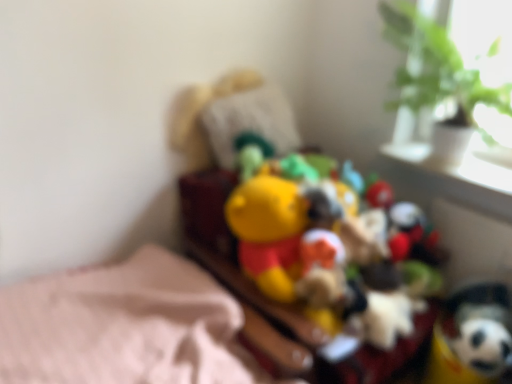
This screenshot has height=384, width=512. Describe the element at coordinates (449, 178) in the screenshot. I see `white glossy window sill at upper right` at that location.

What do you see at coordinates (437, 73) in the screenshot? The height and width of the screenshot is (384, 512). I see `green leafy plant at upper right` at bounding box center [437, 73].

Locate an element on the screen. This screenshot has height=384, width=512. yellow plush toy at center, which ranks as the 1th toy in left-to-right order is located at coordinates (317, 245).

Is soft plush toy at lower right, the second toy when ordered from left to right, at the left side of white glossy window sill at upper right?

Yes, soft plush toy at lower right, the second toy when ordered from left to right, is to the left of white glossy window sill at upper right.

Based on their sizes in the image, would you say soft plush toy at lower right, placed as the first toy when sorted from right to left, is bigger or smaller than white glossy window sill at upper right?

Considering their sizes, soft plush toy at lower right, placed as the first toy when sorted from right to left, takes up more space than white glossy window sill at upper right.

From the image's perspective, is soft plush toy at lower right, the second toy when ordered from left to right, on top of white glossy window sill at upper right?

No.

From a real-world perspective, which is physically above, soft plush toy at lower right, placed as the first toy when sorted from right to left, or white glossy window sill at upper right?

white glossy window sill at upper right is physically above.

Consider the image. From the image's perspective, is green leafy plant at upper right positioned above or below soft plush toy at lower right, the second toy when ordered from left to right?

From the image's perspective, green leafy plant at upper right appears above soft plush toy at lower right, the second toy when ordered from left to right.

Is the depth of green leafy plant at upper right less than that of soft plush toy at lower right, the second toy when ordered from left to right?

Yes, it is in front of soft plush toy at lower right, the second toy when ordered from left to right.

Is green leafy plant at upper right at the right side of soft plush toy at lower right, placed as the first toy when sorted from right to left?

Incorrect, green leafy plant at upper right is not on the right side of soft plush toy at lower right, placed as the first toy when sorted from right to left.

Could you tell me if green leafy plant at upper right is turned towards soft plush toy at lower right, the second toy when ordered from left to right?

No, green leafy plant at upper right is not oriented towards soft plush toy at lower right, the second toy when ordered from left to right.

Is soft plush toy at lower right, the second toy when ordered from left to right, with green leafy plant at upper right?

No, soft plush toy at lower right, the second toy when ordered from left to right, is not next to green leafy plant at upper right.

How different are the orientations of soft plush toy at lower right, the second toy when ordered from left to right, and green leafy plant at upper right in degrees?

There is a 0.000124-degree angle between the facing directions of soft plush toy at lower right, the second toy when ordered from left to right, and green leafy plant at upper right.

From the picture: How far apart are soft plush toy at lower right, the second toy when ordered from left to right, and green leafy plant at upper right?

soft plush toy at lower right, the second toy when ordered from left to right, is 32.21 inches away from green leafy plant at upper right.

Where is `the 2nd toy below the green leafy plant at upper right (from the image's perspective)`? The width and height of the screenshot is (512, 384). the 2nd toy below the green leafy plant at upper right (from the image's perspective) is located at coordinates (472, 337).

What's the angular difference between white glossy window sill at upper right and green leafy plant at upper right's facing directions?

3.17 degrees separate the facing orientations of white glossy window sill at upper right and green leafy plant at upper right.

Which of these two, white glossy window sill at upper right or green leafy plant at upper right, stands taller?

With more height is green leafy plant at upper right.

Which is behind, white glossy window sill at upper right or green leafy plant at upper right?

white glossy window sill at upper right is further away from the camera.

Consider the image. Are white glossy window sill at upper right and green leafy plant at upper right making contact?

No.

Is yellow plush toy at center, arranged as the 2th toy when viewed from the right, spatially inside green leafy plant at upper right, or outside of it?

yellow plush toy at center, arranged as the 2th toy when viewed from the right, is outside green leafy plant at upper right.

Between yellow plush toy at center, which ranks as the 1th toy in left-to-right order, and green leafy plant at upper right, which one has more height?

yellow plush toy at center, which ranks as the 1th toy in left-to-right order.

Is yellow plush toy at center, arranged as the 2th toy when viewed from the right, to the left of green leafy plant at upper right from the viewer's perspective?

Indeed, yellow plush toy at center, arranged as the 2th toy when viewed from the right, is positioned on the left side of green leafy plant at upper right.

Is yellow plush toy at center, which ranks as the 1th toy in left-to-right order, oriented away from green leafy plant at upper right?

No, green leafy plant at upper right is not at the back of yellow plush toy at center, which ranks as the 1th toy in left-to-right order.

Does white glossy window sill at upper right lie behind soft plush toy at lower right, placed as the first toy when sorted from right to left?

Yes, white glossy window sill at upper right is behind soft plush toy at lower right, placed as the first toy when sorted from right to left.

Is soft plush toy at lower right, the second toy when ordered from left to right, completely or partially inside white glossy window sill at upper right?

That's incorrect, soft plush toy at lower right, the second toy when ordered from left to right, is not inside white glossy window sill at upper right.

Is white glossy window sill at upper right directly adjacent to soft plush toy at lower right, placed as the first toy when sorted from right to left?

white glossy window sill at upper right and soft plush toy at lower right, placed as the first toy when sorted from right to left, are clearly separated.

Is yellow plush toy at center, which ranks as the 1th toy in left-to-right order, positioned beyond the bounds of white glossy window sill at upper right?

Indeed, yellow plush toy at center, which ranks as the 1th toy in left-to-right order, is completely outside white glossy window sill at upper right.

Are yellow plush toy at center, arranged as the 2th toy when viewed from the right, and white glossy window sill at upper right located far from each other?

No, yellow plush toy at center, arranged as the 2th toy when viewed from the right, is not far from white glossy window sill at upper right.

Is the position of yellow plush toy at center, which ranks as the 1th toy in left-to-right order, more distant than that of white glossy window sill at upper right?

No, yellow plush toy at center, which ranks as the 1th toy in left-to-right order, is in front of white glossy window sill at upper right.

How many degrees apart are the facing directions of yellow plush toy at center, arranged as the 2th toy when viewed from the right, and white glossy window sill at upper right?

There is a 89.1-degree angle between the facing directions of yellow plush toy at center, arranged as the 2th toy when viewed from the right, and white glossy window sill at upper right.

From the image's perspective, which toy is the 2nd one below the white glossy window sill at upper right? Please provide its 2D coordinates.

[(472, 337)]

You are a GUI agent. You are given a task and a screenshot of the screen. Output one action in this format:
    pyautogui.click(x=<x>, y=<y>)
    Task: Click on the houseplant located above the soft plush toy at lower right, placed as the first toy when sorted from right to left (from the image's perspective)
    This screenshot has width=512, height=384.
    Given the screenshot: What is the action you would take?
    437,73

When comparing their distances from white glossy window sill at upper right, does yellow plush toy at center, arranged as the 2th toy when viewed from the right, or soft plush toy at lower right, placed as the first toy when sorted from right to left, seem further?

yellow plush toy at center, arranged as the 2th toy when viewed from the right, lies further to white glossy window sill at upper right than the other object.

When comparing their distances from yellow plush toy at center, arranged as the 2th toy when viewed from the right, does soft plush toy at lower right, the second toy when ordered from left to right, or green leafy plant at upper right seem further?

Based on the image, green leafy plant at upper right appears to be further to yellow plush toy at center, arranged as the 2th toy when viewed from the right.

From the image, which object appears to be farther from yellow plush toy at center, which ranks as the 1th toy in left-to-right order, white glossy window sill at upper right or green leafy plant at upper right?

Based on the image, green leafy plant at upper right appears to be further to yellow plush toy at center, which ranks as the 1th toy in left-to-right order.

Looking at the image, which one is located further to yellow plush toy at center, arranged as the 2th toy when viewed from the right, green leafy plant at upper right or white glossy window sill at upper right?

Among the two, green leafy plant at upper right is located further to yellow plush toy at center, arranged as the 2th toy when viewed from the right.

Which object lies further to the anchor point white glossy window sill at upper right, yellow plush toy at center, arranged as the 2th toy when viewed from the right, or green leafy plant at upper right?

Among the two, yellow plush toy at center, arranged as the 2th toy when viewed from the right, is located further to white glossy window sill at upper right.

Looking at the image, which one is located further to white glossy window sill at upper right, soft plush toy at lower right, the second toy when ordered from left to right, or yellow plush toy at center, arranged as the 2th toy when viewed from the right?

The object further to white glossy window sill at upper right is yellow plush toy at center, arranged as the 2th toy when viewed from the right.

Which object lies nearer to the anchor point green leafy plant at upper right, white glossy window sill at upper right or yellow plush toy at center, which ranks as the 1th toy in left-to-right order?

white glossy window sill at upper right lies closer to green leafy plant at upper right than the other object.

Based on their spatial positions, is green leafy plant at upper right or soft plush toy at lower right, the second toy when ordered from left to right, further from yellow plush toy at center, arranged as the 2th toy when viewed from the right?

green leafy plant at upper right.

I want to click on window sill between green leafy plant at upper right and yellow plush toy at center, which ranks as the 1th toy in left-to-right order, in the vertical direction, so click(449, 178).

Find the location of a particular element. This screenshot has width=512, height=384. window sill between green leafy plant at upper right and soft plush toy at lower right, the second toy when ordered from left to right, in the vertical direction is located at coordinates (449, 178).

Where is `toy between white glossy window sill at upper right and soft plush toy at lower right, placed as the first toy when sorted from right to left, in the vertical direction`? toy between white glossy window sill at upper right and soft plush toy at lower right, placed as the first toy when sorted from right to left, in the vertical direction is located at coordinates (317, 245).

The image size is (512, 384). Identify the location of toy between green leafy plant at upper right and soft plush toy at lower right, the second toy when ordered from left to right, from top to bottom. (317, 245).